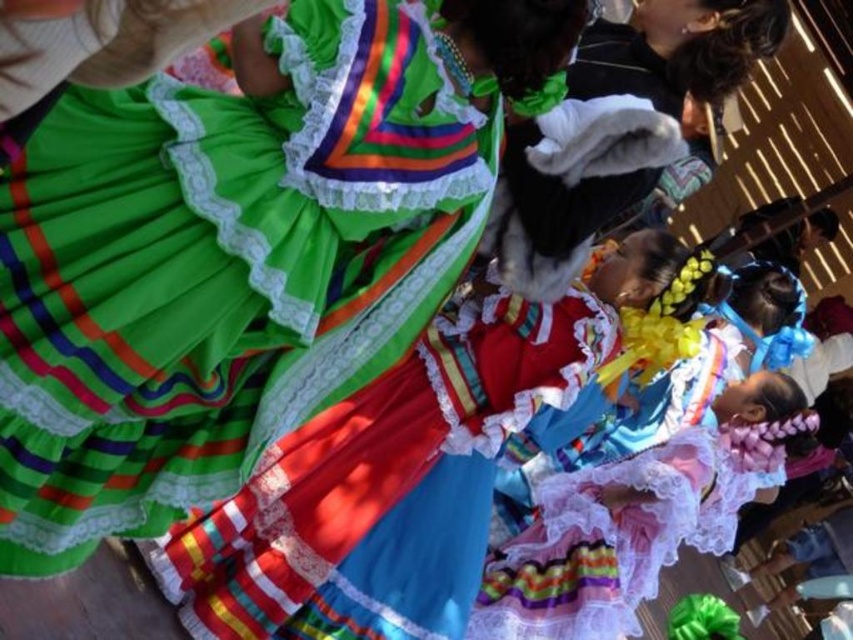
Is matte green fabric dress at center positioned in front of white fur hat at upper right?

Yes, it is in front of white fur hat at upper right.

Who is more distant from viewer, (138, 536) or (683, 52)?

The point (683, 52) is more distant.

At what (x,y) coordinates should I click in order to perform the action: click on matte green fabric dress at center. Please return your answer as a coordinate pair (x, y). The height and width of the screenshot is (640, 853). Looking at the image, I should click on (221, 268).

Can you confirm if matte green fabric dress at center is positioned to the left of pastel lace dress at center?

Correct, you'll find matte green fabric dress at center to the left of pastel lace dress at center.

Is matte green fabric dress at center behind pastel lace dress at center?

No, matte green fabric dress at center is closer to the viewer.

This screenshot has height=640, width=853. I want to click on matte green fabric dress at center, so click(x=221, y=268).

Locate an element on the screen. The width and height of the screenshot is (853, 640). matte green fabric dress at center is located at coordinates (221, 268).

Who is lower down, pastel lace dress at center or white fur hat at upper right?

pastel lace dress at center

Measure the distance between pastel lace dress at center and white fur hat at upper right.

A distance of 9.03 meters exists between pastel lace dress at center and white fur hat at upper right.

Where is `pastel lace dress at center`? The height and width of the screenshot is (640, 853). pastel lace dress at center is located at coordinates (636, 518).

At what (x,y) coordinates should I click in order to perform the action: click on pastel lace dress at center. Please return your answer as a coordinate pair (x, y). The height and width of the screenshot is (640, 853). Looking at the image, I should click on (636, 518).